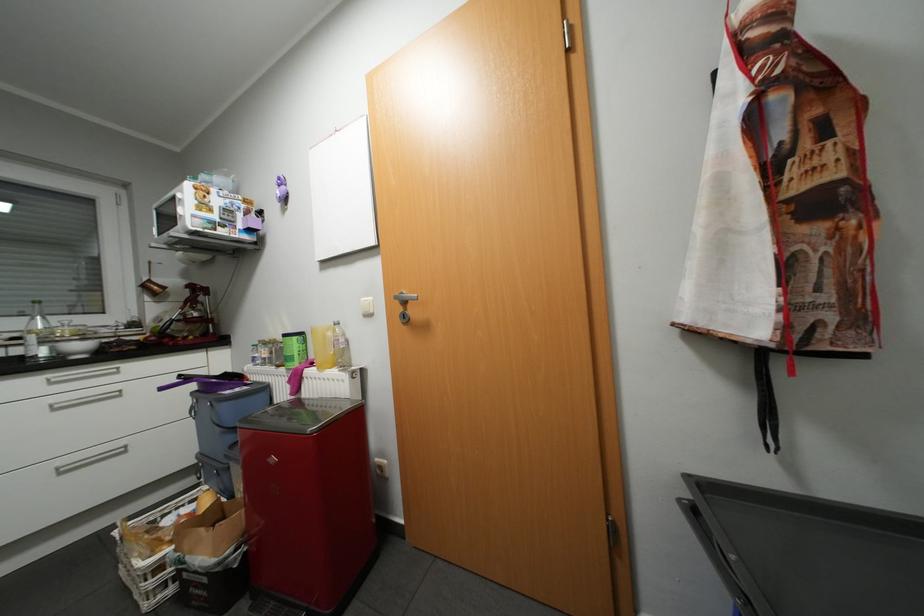
I want to click on white light switch, so click(367, 306).